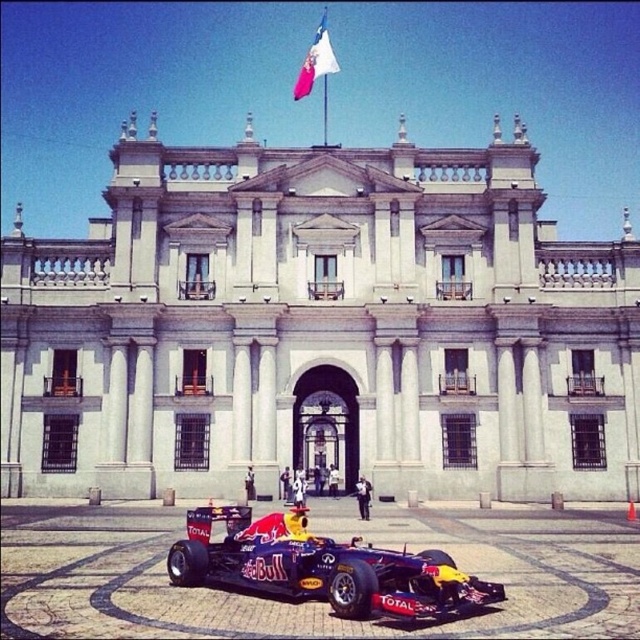
You are standing in front of the white stone building at center and want to find the white fabric flag at upper center. In which direction should you look relative to the building?

The white fabric flag at upper center is to the right of the white stone building at center, so you should look to the right relative to the building.

You are a drone operator tasked with capturing aerial footage of the white stone building at center and the white fabric flag at upper center. The minimum safe distance between the drone and any object is 5 meters. Can you fly the drone between them without violating the safety regulations?

The white stone building at center is 28.80 meters from the white fabric flag at upper center. Since the minimum safe distance is 5 meters, the drone can safely fly between them as the distance between them is well above the required safety margin.

You are standing in front of a grand neoclassical building and want to locate the white stone building at center. According to the coordinates provided, where exactly should you look to find it?

The white stone building at center is located at the coordinates point (321, 328).